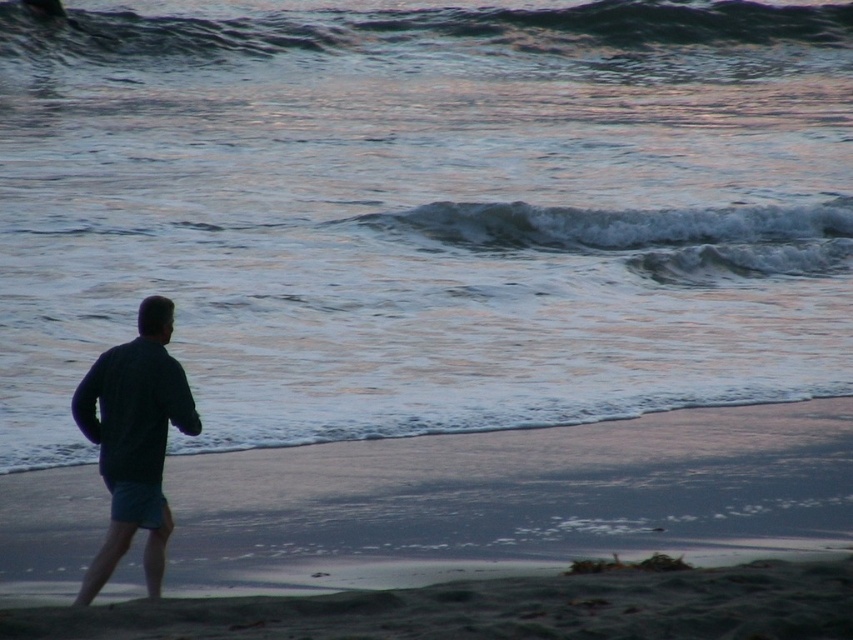
Is the position of shiny blue water at center less distant than that of dark blue fabric at left?

No, shiny blue water at center is behind dark blue fabric at left.

Who is more forward, [453,13] or [138,349]?

Point [138,349]

In order to click on shiny blue water at center in this screenshot , I will do `click(424, 209)`.

Which is in front, point (727, 248) or point (148, 468)?

Positioned in front is point (148, 468).

Find the location of a particular element. The image size is (853, 640). white frothy wave at upper center is located at coordinates (634, 236).

Can you confirm if shiny blue water at center is shorter than white frothy wave at upper center?

No.

Is point (843, 179) positioned before point (560, 244)?

No, (843, 179) is behind (560, 244).

Between point (49, 134) and point (840, 244), which one is positioned behind?

The point (49, 134) is behind.

Identify the location of shiny blue water at center. The image size is (853, 640). (424, 209).